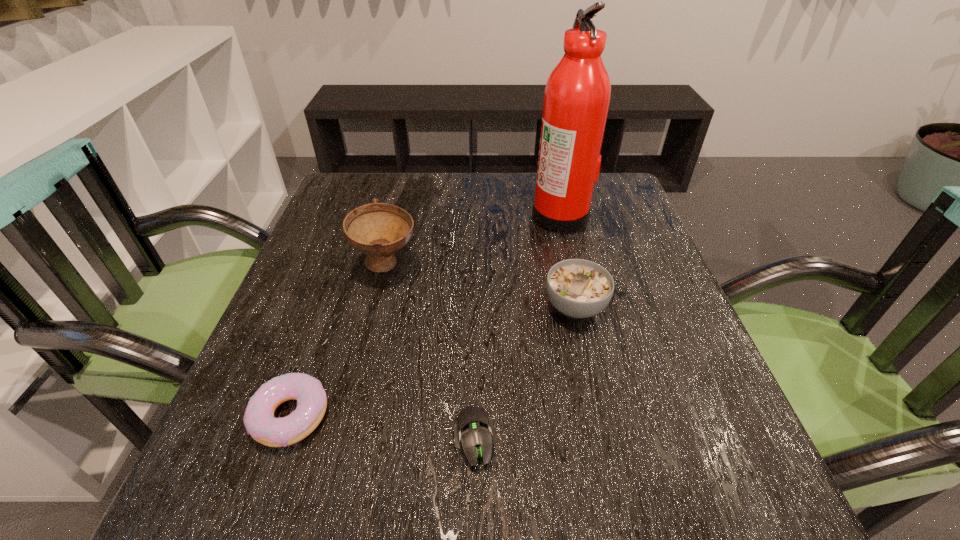
Where is `the tallest object`? The height and width of the screenshot is (540, 960). the tallest object is located at coordinates (578, 91).

This screenshot has height=540, width=960. In order to click on fire extinguisher in this screenshot , I will do `click(578, 91)`.

Locate an element on the screen. The image size is (960, 540). the second tallest object is located at coordinates (378, 230).

Where is `the left soup bowl`? The height and width of the screenshot is (540, 960). the left soup bowl is located at coordinates (378, 230).

Identify the location of the right soup bowl. (578, 288).

Identify the location of the shorter soup bowl. (578, 288).

At what (x,y) coordinates should I click in order to perform the action: click on doughnut. Please return your answer as a coordinate pair (x, y). Looking at the image, I should click on (260, 423).

The image size is (960, 540). Find the location of `computer mouse`. computer mouse is located at coordinates (473, 428).

Image resolution: width=960 pixels, height=540 pixels. I want to click on the third object from left to right, so click(473, 428).

Where is `free space located on the label side of the fire extinguisher`? The width and height of the screenshot is (960, 540). free space located on the label side of the fire extinguisher is located at coordinates (419, 215).